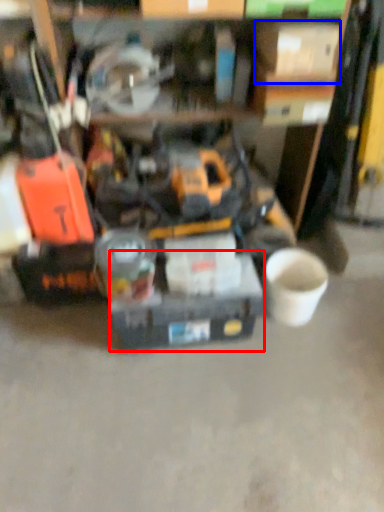
Question: Which point is closer to the camera, box (highlighted by a red box) or box (highlighted by a blue box)?

Choices:
 (A) box
 (B) box

Answer: (B)